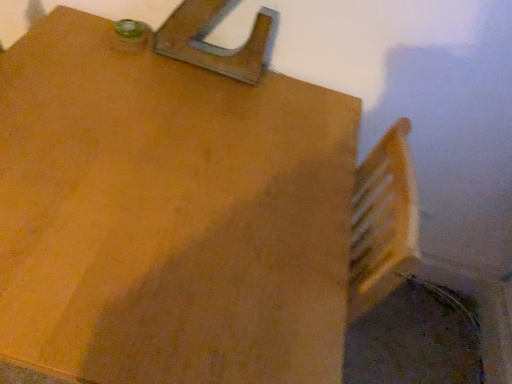
Question: From the image's perspective, does matte wood table at upper left appear lower than wooden at upper center?

Choices:
 (A) no
 (B) yes

Answer: (B)

Question: Does matte wood table at upper left have a lesser width compared to wooden at upper center?

Choices:
 (A) no
 (B) yes

Answer: (A)

Question: Considering the relative sizes of matte wood table at upper left and wooden at upper center in the image provided, is matte wood table at upper left bigger than wooden at upper center?

Choices:
 (A) yes
 (B) no

Answer: (A)

Question: Is matte wood table at upper left further to camera compared to wooden at upper center?

Choices:
 (A) yes
 (B) no

Answer: (B)

Question: Is matte wood table at upper left next to wooden at upper center and touching it?

Choices:
 (A) no
 (B) yes

Answer: (A)

Question: Does matte wood table at upper left have a greater width compared to wooden at upper center?

Choices:
 (A) no
 (B) yes

Answer: (B)

Question: Does wooden at upper center have a greater width compared to matte wood table at upper left?

Choices:
 (A) yes
 (B) no

Answer: (B)

Question: Can you confirm if wooden at upper center is positioned to the right of matte wood table at upper left?

Choices:
 (A) yes
 (B) no

Answer: (A)

Question: Considering the relative positions of wooden at upper center and matte wood table at upper left in the image provided, is wooden at upper center behind matte wood table at upper left?

Choices:
 (A) no
 (B) yes

Answer: (B)

Question: From a real-world perspective, does wooden at upper center sit lower than matte wood table at upper left?

Choices:
 (A) yes
 (B) no

Answer: (B)

Question: From a real-world perspective, is wooden at upper center positioned over matte wood table at upper left based on gravity?

Choices:
 (A) yes
 (B) no

Answer: (A)

Question: Are wooden at upper center and matte wood table at upper left far apart?

Choices:
 (A) no
 (B) yes

Answer: (A)

Question: Considering the relative positions of matte wood table at upper left and wooden at upper center in the image provided, is matte wood table at upper left to the left or to the right of wooden at upper center?

Choices:
 (A) left
 (B) right

Answer: (A)